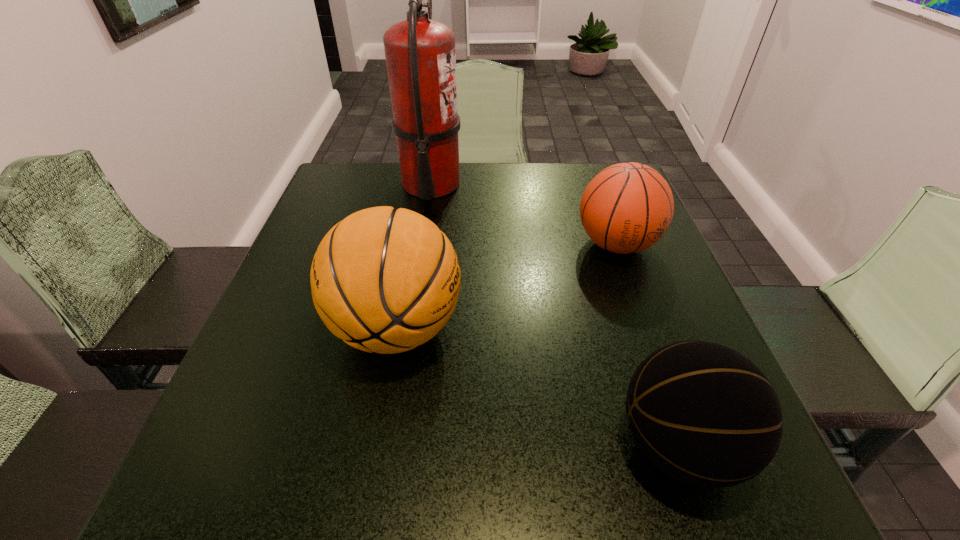
Find the location of a particular element. This screenshot has width=960, height=540. free spot that satisfies the following two spatial constraints: 1. on the surface of the third shortest object near the brand logo; 2. on the back side of the nearest object is located at coordinates (376, 444).

Image resolution: width=960 pixels, height=540 pixels. Identify the location of vacant region that satisfies the following two spatial constraints: 1. on the surface of the nearest basketball near the brand logo; 2. on the right side of the second farthest basketball. (376, 444).

Where is `free spot that satisfies the following two spatial constraints: 1. toward the nozzle of the nearest object; 2. on the right side of the fire extinguisher`? This screenshot has height=540, width=960. free spot that satisfies the following two spatial constraints: 1. toward the nozzle of the nearest object; 2. on the right side of the fire extinguisher is located at coordinates (392, 444).